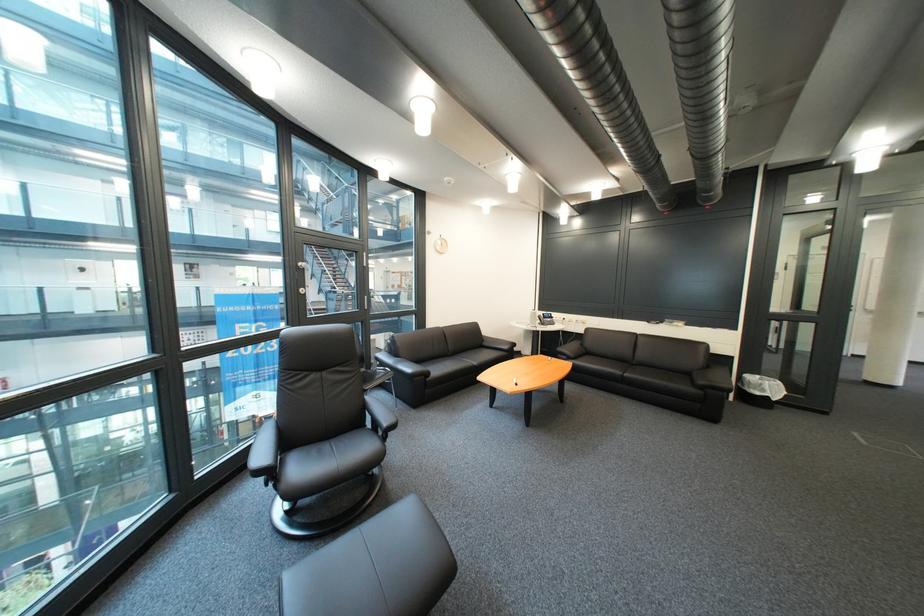
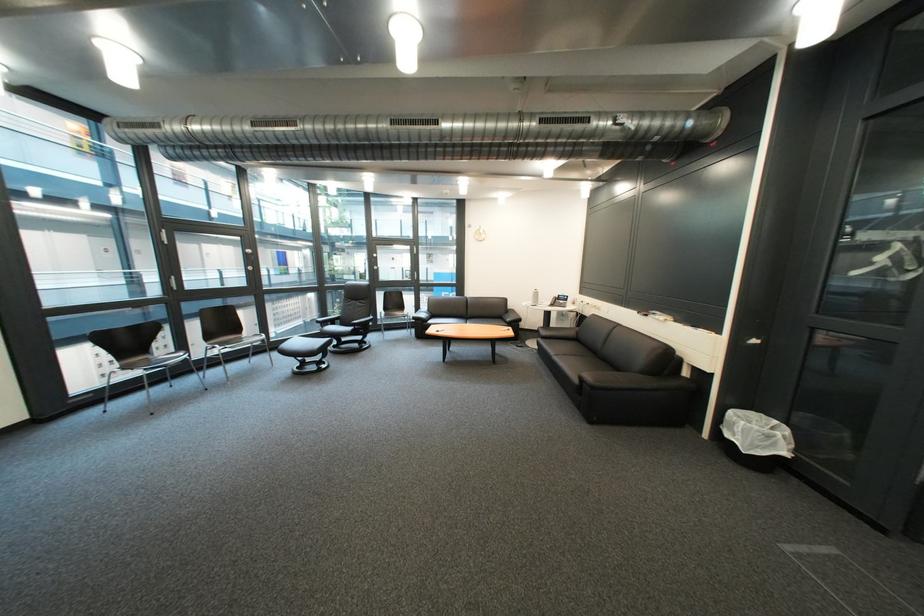
Where in the second image is the point corresponding to the point at 715,390 from the first image?

(594, 381)